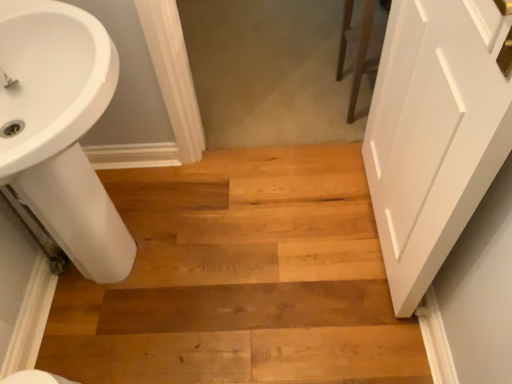
Question: Is white glossy sink at lower left positioned with its back to natural wood floor at center?

Choices:
 (A) yes
 (B) no

Answer: (B)

Question: From the image's perspective, is white glossy sink at lower left on natural wood floor at center?

Choices:
 (A) yes
 (B) no

Answer: (A)

Question: Can you confirm if white glossy sink at lower left is positioned to the right of natural wood floor at center?

Choices:
 (A) no
 (B) yes

Answer: (A)

Question: Is white glossy sink at lower left aimed at natural wood floor at center?

Choices:
 (A) no
 (B) yes

Answer: (B)

Question: Does white glossy sink at lower left have a greater width compared to natural wood floor at center?

Choices:
 (A) yes
 (B) no

Answer: (B)

Question: Can you confirm if white glossy sink at lower left is shorter than natural wood floor at center?

Choices:
 (A) no
 (B) yes

Answer: (A)

Question: Is white matte door at right turned away from natural wood floor at center?

Choices:
 (A) no
 (B) yes

Answer: (A)

Question: Considering the relative sizes of white matte door at right and natural wood floor at center in the image provided, is white matte door at right thinner than natural wood floor at center?

Choices:
 (A) yes
 (B) no

Answer: (A)

Question: From a real-world perspective, is white matte door at right positioned under natural wood floor at center based on gravity?

Choices:
 (A) yes
 (B) no

Answer: (B)

Question: Is the depth of white matte door at right less than that of natural wood floor at center?

Choices:
 (A) yes
 (B) no

Answer: (A)

Question: Is white matte door at right bigger than natural wood floor at center?

Choices:
 (A) yes
 (B) no

Answer: (B)

Question: Are white matte door at right and natural wood floor at center beside each other?

Choices:
 (A) no
 (B) yes

Answer: (A)

Question: Would you consider white glossy sink at lower left to be distant from white matte door at right?

Choices:
 (A) no
 (B) yes

Answer: (A)